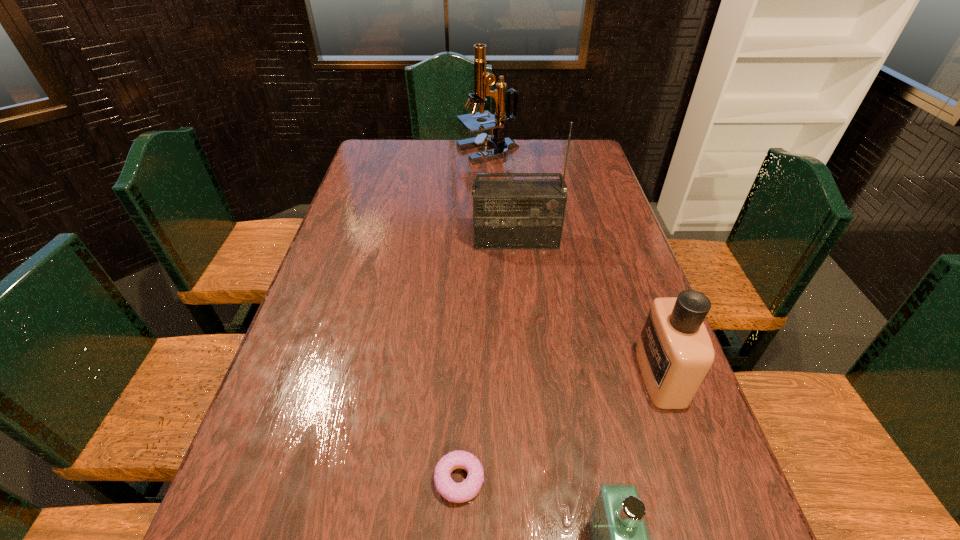
Image resolution: width=960 pixels, height=540 pixels. I want to click on microscope, so click(483, 79).

I want to click on radio receiver, so click(x=507, y=214).

This screenshot has width=960, height=540. What are the coordinates of `the farther perfume` in the screenshot? It's located at (674, 351).

The width and height of the screenshot is (960, 540). What are the coordinates of `the taller perfume` in the screenshot? It's located at (674, 351).

Image resolution: width=960 pixels, height=540 pixels. In order to click on the second nearest object in this screenshot , I will do `click(464, 491)`.

I want to click on the shortest object, so 464,491.

At what (x,y) coordinates should I click in order to perform the action: click on free space located 0.260m at the eyepiece of the farthest object. Please return your answer as a coordinate pair (x, y). This screenshot has height=540, width=960. Looking at the image, I should click on (391, 152).

I want to click on free space located 0.230m at the eyepiece of the farthest object, so click(x=398, y=152).

You are a GUI agent. You are given a task and a screenshot of the screen. Output one action in this format:
    pyautogui.click(x=<x>, y=<y>)
    Task: Click on the free region located at the eyepiece of the farthest object
    This screenshot has height=540, width=960.
    Given the screenshot: What is the action you would take?
    pyautogui.click(x=396, y=152)

Find the location of a particular element. free point located 0.300m on the front panel of the fourth nearest object is located at coordinates (524, 327).